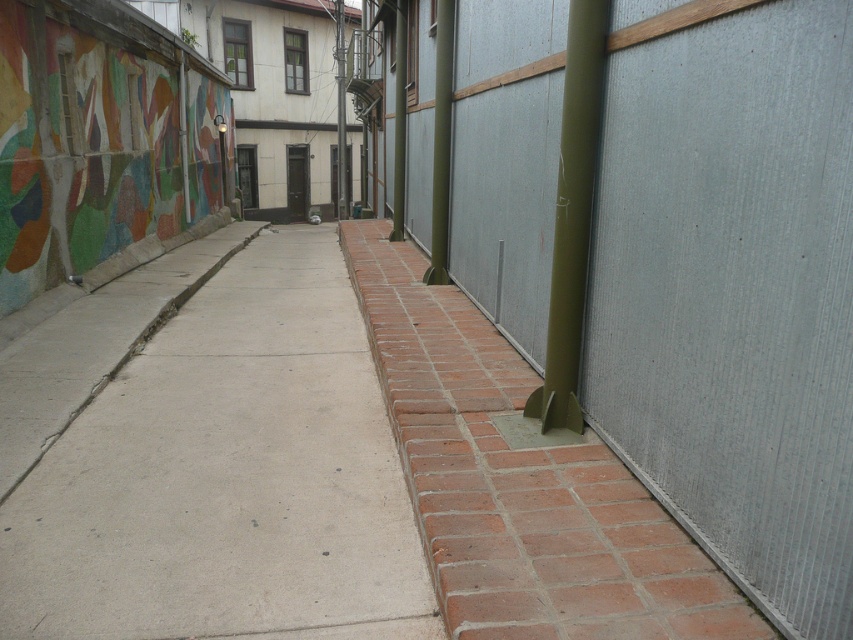
You are standing in the alleyway between the vibrant mural wall on the left and the plain gray wall with wooden planks on the right. You notice a point marked at coordinates (x=730, y=285). Which object from the scene does this point belong to?

The point at coordinates (x=730, y=285) belongs to the green corrugated metal fence at center right.